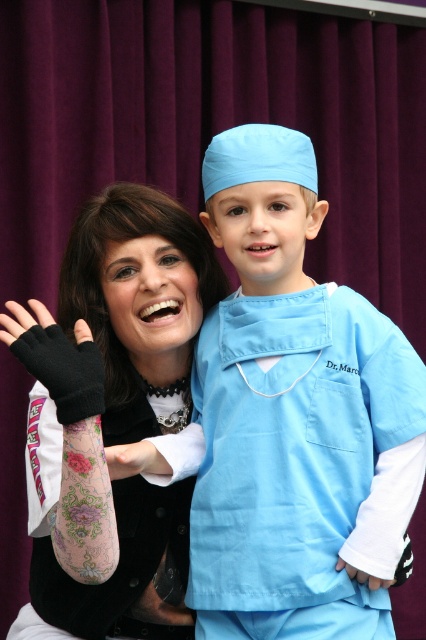
Question: Among these objects, which one is nearest to the camera?

Choices:
 (A) floral tattooed arm at center
 (B) light blue fabric at center

Answer: (A)

Question: Is light blue fabric at center positioned at the back of floral tattooed arm at center?

Choices:
 (A) no
 (B) yes

Answer: (B)

Question: Does light blue fabric at center appear over floral tattooed arm at center?

Choices:
 (A) yes
 (B) no

Answer: (A)

Question: Is light blue fabric at center further to camera compared to floral tattooed arm at center?

Choices:
 (A) yes
 (B) no

Answer: (A)